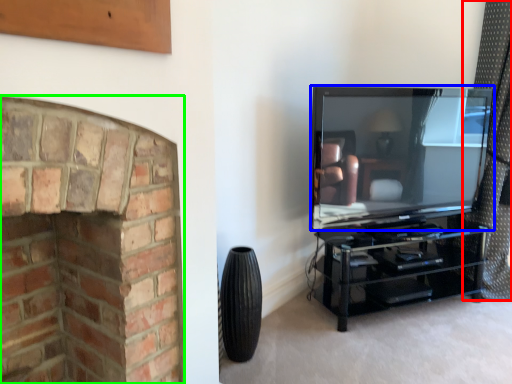
Question: Which object is the farthest from curtain (highlighted by a red box)? Choose among these: television (highlighted by a blue box) or fireplace (highlighted by a green box).

Choices:
 (A) television
 (B) fireplace

Answer: (B)